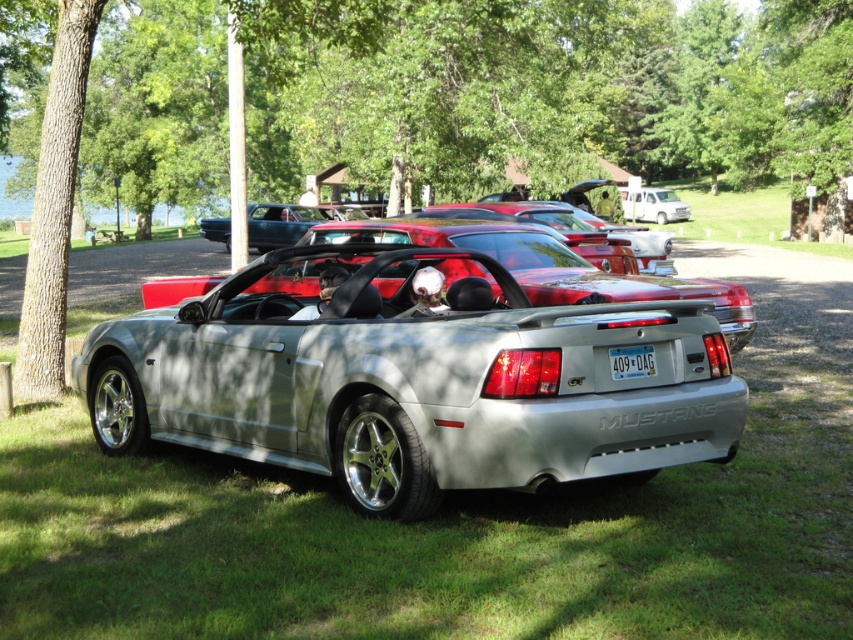
You are standing in the grassy area looking at the cars. Which object is nearer to you, the green grass at center or the white plastic license plate at center?

The green grass at center is closer to the viewer than the white plastic license plate at center.

You are a photographer trying to capture both the silver metallic convertible at center and the white matte van at upper center in a single frame. Given their sizes, which vehicle should you position closer to the camera to ensure both are visible in the frame without cropping?

Since the silver metallic convertible at center is smaller than the white matte van at upper center, you should position the silver metallic convertible at center closer to the camera. This will help balance their sizes in the frame, ensuring both are visible without cropping.

You are a photographer wanting to capture both the green grass at center and the silver metallic convertible at center in a single frame. Based on their distance apart, can you fit both into your camera viewfinder without moving your position?

The green grass at center and silver metallic convertible at center are 9.34 feet apart. Since the distance between them is fixed, you can adjust your camera angle or zoom to include both in your frame as long as your camera can accommodate the 9.34 feet span between them.